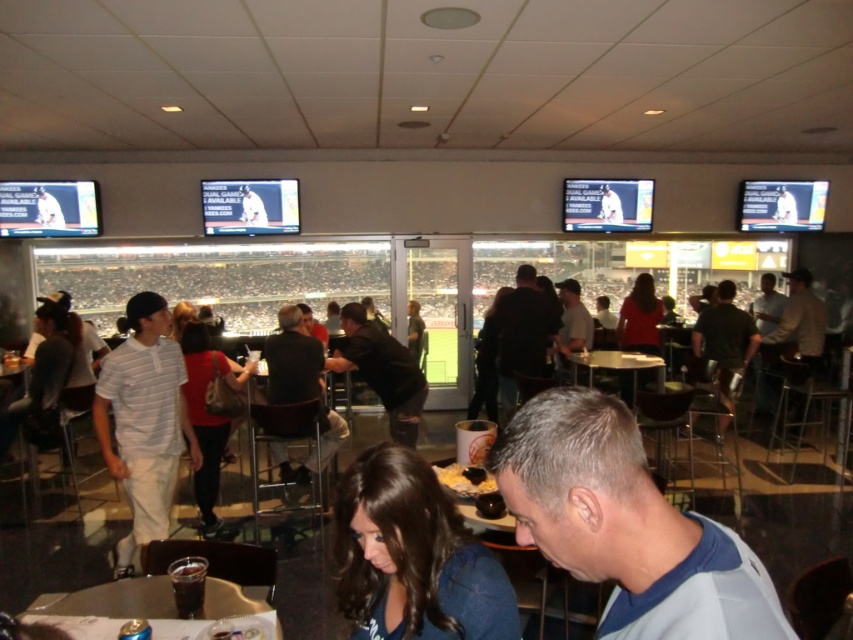
What are the coordinates of `clear plastic cup at lower center` in the screenshot? It's located at (114, 600).

Which is above, clear plastic cup at lower center or metallic silver table at center?

Positioned higher is metallic silver table at center.

Is point (225, 592) closer to camera compared to point (606, 353)?

That is True.

The width and height of the screenshot is (853, 640). I want to click on clear plastic cup at lower center, so 114,600.

Who is shorter, black matte shirt at center or metallic silver table at center?

With less height is metallic silver table at center.

The height and width of the screenshot is (640, 853). What are the coordinates of `black matte shirt at center` in the screenshot? It's located at (381, 371).

Can you confirm if dark blue sweater at lower center is wider than dark brown leather jacket at center?

In fact, dark blue sweater at lower center might be narrower than dark brown leather jacket at center.

Is point (410, 596) in front of point (276, 390)?

Yes, point (410, 596) is in front of point (276, 390).

Identify the location of dark blue sweater at lower center. The image size is (853, 640). (413, 556).